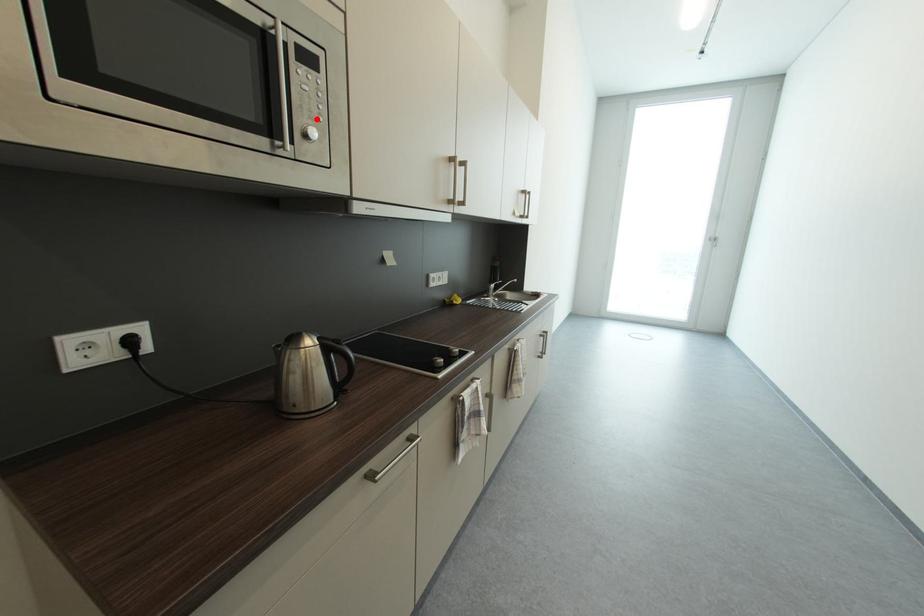
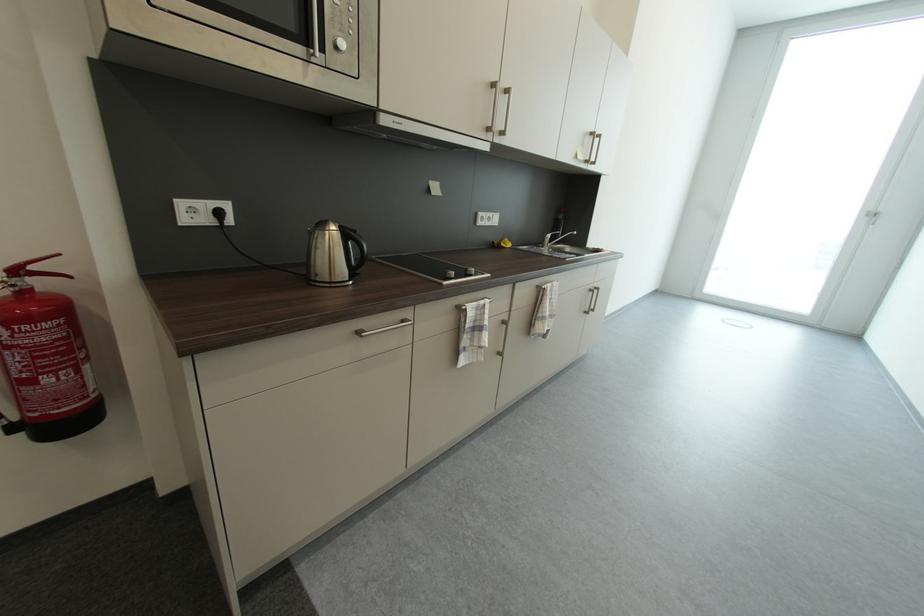
Find the pixel in the second image that matches the highlighted location in the first image.

(347, 33)